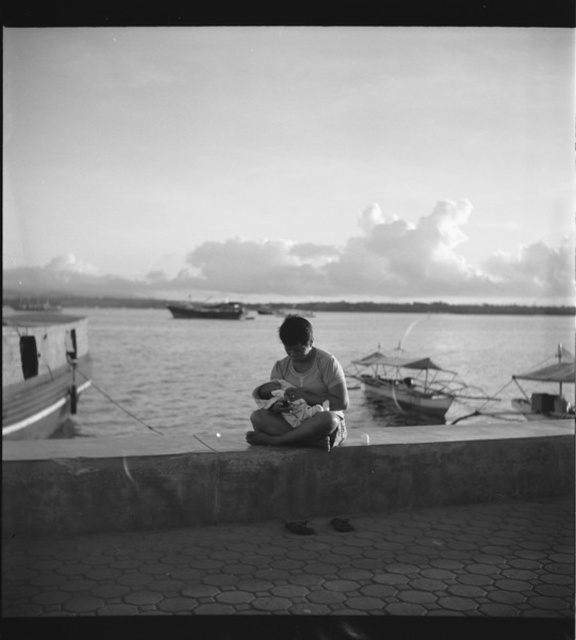
Question: Is smooth water at center to the right of wooden boat at left from the viewer's perspective?

Choices:
 (A) yes
 (B) no

Answer: (A)

Question: Which point is farther to the camera?

Choices:
 (A) smooth water at center
 (B) soft skin baby at center
 (C) wooden boat at center

Answer: (C)

Question: Does smooth concrete ledge at center have a greater width compared to wooden boat at left?

Choices:
 (A) no
 (B) yes

Answer: (A)

Question: Which is farther from the smooth skin woman at center?

Choices:
 (A) wooden boat at left
 (B) smooth concrete ledge at center
 (C) smooth wooden boat at right

Answer: (C)

Question: Which object is farther from the camera taking this photo?

Choices:
 (A) smooth concrete ledge at center
 (B) smooth wooden boat at center

Answer: (B)

Question: Is smooth concrete ledge at center positioned in front of smooth wooden boat at center?

Choices:
 (A) yes
 (B) no

Answer: (A)